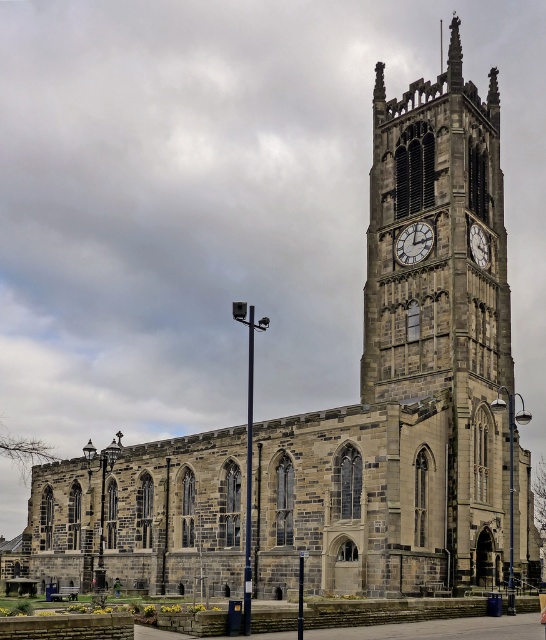
Based on the photo, is the position of stone clock tower at center more distant than that of stone clock tower at upper center?

Yes.

Where is `stone clock tower at center`? stone clock tower at center is located at coordinates (413, 243).

Describe the element at coordinates (413, 243) in the screenshot. This screenshot has height=640, width=546. I see `stone clock tower at center` at that location.

Where is `stone clock tower at center`? Image resolution: width=546 pixels, height=640 pixels. stone clock tower at center is located at coordinates (413, 243).

Measure the distance between dark gray stone clock tower at center and camera.

dark gray stone clock tower at center and camera are 58.07 meters apart.

Does dark gray stone clock tower at center have a smaller size compared to stone clock tower at center?

No, dark gray stone clock tower at center is not smaller than stone clock tower at center.

Image resolution: width=546 pixels, height=640 pixels. Describe the element at coordinates (443, 304) in the screenshot. I see `dark gray stone clock tower at center` at that location.

The width and height of the screenshot is (546, 640). I want to click on dark gray stone clock tower at center, so click(443, 304).

Describe the element at coordinates (443, 304) in the screenshot. I see `dark gray stone clock tower at center` at that location.

Between dark gray stone clock tower at center and stone clock tower at upper center, which one is positioned higher?

dark gray stone clock tower at center

Find the location of a particular element. dark gray stone clock tower at center is located at coordinates (443, 304).